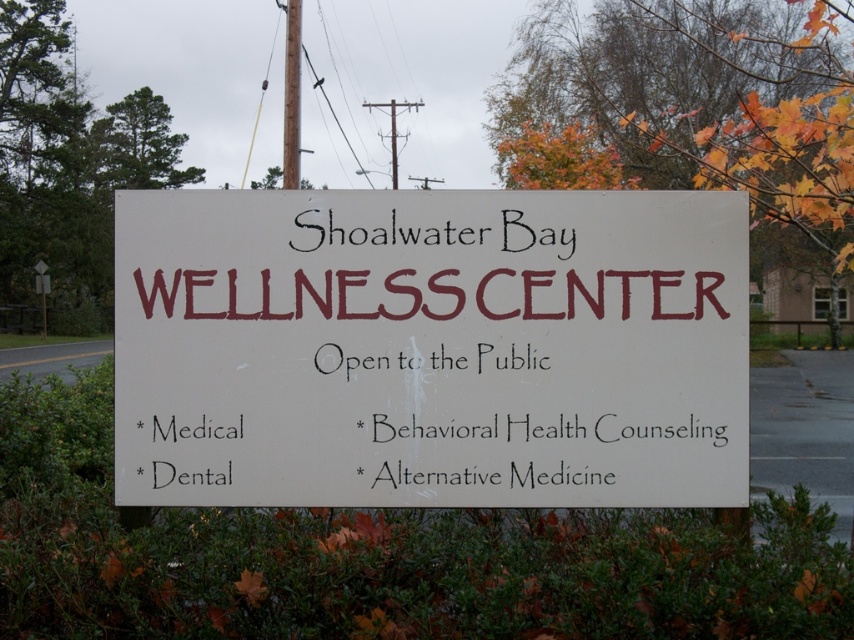
Question: Can you confirm if white matte sign at center is bigger than white plastic sign at upper center?

Choices:
 (A) no
 (B) yes

Answer: (A)

Question: Is white matte sign at center further to camera compared to white plastic sign at upper center?

Choices:
 (A) yes
 (B) no

Answer: (B)

Question: Is white matte sign at center behind white plastic sign at upper center?

Choices:
 (A) yes
 (B) no

Answer: (B)

Question: Which object appears farthest from the camera in this image?

Choices:
 (A) white matte sign at center
 (B) white plastic sign at upper center

Answer: (B)

Question: Which point is closer to the camera taking this photo?

Choices:
 (A) (553, 349)
 (B) (42, 288)

Answer: (A)